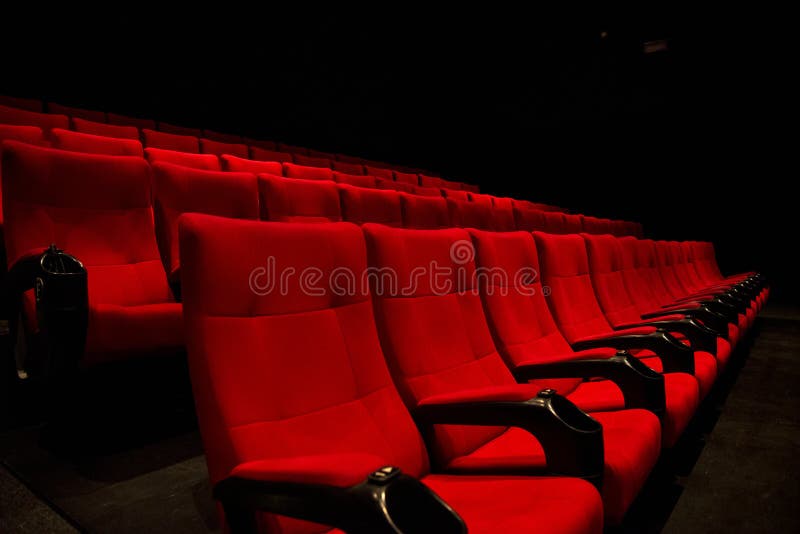
This screenshot has width=800, height=534. I want to click on chair buttons, so click(x=382, y=478), click(x=386, y=468), click(x=546, y=395), click(x=550, y=388), click(x=622, y=354), click(x=622, y=352), click(x=661, y=332).